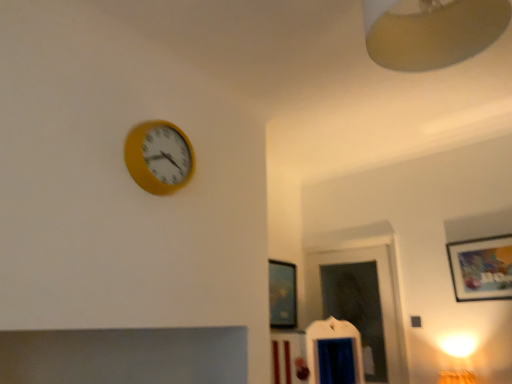
You are a GUI agent. You are given a task and a screenshot of the screen. Output one action in this format:
    pyautogui.click(x=<x>, y=<y>)
    Task: Click on the yellow matte clock at upper left
    The height and width of the screenshot is (384, 512).
    Given the screenshot: What is the action you would take?
    pyautogui.click(x=159, y=157)

What do you see at coordinates (481, 268) in the screenshot?
I see `matte wooden picture frame at upper right, the second picture frame when ordered from left to right` at bounding box center [481, 268].

This screenshot has width=512, height=384. Describe the element at coordinates (282, 294) in the screenshot. I see `matte black picture frame at center, which appears as the 2th picture frame when viewed from the front` at that location.

Locate an element on the screen. Image resolution: width=512 pixels, height=384 pixels. matte beige lampshade at upper right is located at coordinates (433, 33).

Image resolution: width=512 pixels, height=384 pixels. In order to click on yellow matte clock at upper left in this screenshot , I will do `click(159, 157)`.

Between yellow matte clock at upper left and matte wooden picture frame at upper right, which is counted as the 1th picture frame, starting from the front, which one has less height?

Standing shorter between the two is yellow matte clock at upper left.

You are a GUI agent. You are given a task and a screenshot of the screen. Output one action in this format:
    pyautogui.click(x=<x>, y=<y>)
    Task: Click on the wall clock that is above the matte wooden picture frame at upper right, the second picture frame when ordered from left to right (from the image's perspective)
    
    Given the screenshot: What is the action you would take?
    pyautogui.click(x=159, y=157)

Is matte wooden picture frame at upper right, the 2th picture frame in the back-to-front sequence, located within yellow matte clock at upper left?

That's incorrect, matte wooden picture frame at upper right, the 2th picture frame in the back-to-front sequence, is not inside yellow matte clock at upper left.

Who is shorter, matte black picture frame at center, marked as the 2th picture frame in a right-to-left arrangement, or matte beige lampshade at upper right?

With less height is matte beige lampshade at upper right.

From the image's perspective, is matte black picture frame at center, the 1th picture frame in the left-to-right sequence, located above matte beige lampshade at upper right?

Actually, matte black picture frame at center, the 1th picture frame in the left-to-right sequence, appears below matte beige lampshade at upper right in the image.

Based on the photo, in the image, is matte black picture frame at center, the 1th picture frame in the left-to-right sequence, on the left side or the right side of matte beige lampshade at upper right?

matte black picture frame at center, the 1th picture frame in the left-to-right sequence, is to the left of matte beige lampshade at upper right.

Considering the sizes of matte black picture frame at center, which is the first picture frame from back to front, and matte beige lampshade at upper right in the image, is matte black picture frame at center, which is the first picture frame from back to front, wider or thinner than matte beige lampshade at upper right?

matte black picture frame at center, which is the first picture frame from back to front, is thinner than matte beige lampshade at upper right.

In the scene shown: Is matte beige lampshade at upper right outside of matte black picture frame at center, the 1th picture frame in the left-to-right sequence?

matte beige lampshade at upper right is positioned outside matte black picture frame at center, the 1th picture frame in the left-to-right sequence.

Is matte beige lampshade at upper right in contact with matte black picture frame at center, which is the first picture frame from back to front?

No.

Is matte beige lampshade at upper right aimed at matte black picture frame at center, the 1th picture frame in the left-to-right sequence?

No, matte beige lampshade at upper right is not aimed at matte black picture frame at center, the 1th picture frame in the left-to-right sequence.

From the image's perspective, is matte beige lampshade at upper right on matte black picture frame at center, which appears as the 2th picture frame when viewed from the front?

Correct, matte beige lampshade at upper right appears higher than matte black picture frame at center, which appears as the 2th picture frame when viewed from the front, in the image.

Are matte black picture frame at center, the 1th picture frame in the left-to-right sequence, and matte wooden picture frame at upper right, which is counted as the 1th picture frame, starting from the front, located far from each other?

Yes.

From the picture: Considering the relative positions of matte black picture frame at center, the 1th picture frame in the left-to-right sequence, and matte wooden picture frame at upper right, which ranks as the first picture frame in right-to-left order, in the image provided, is matte black picture frame at center, the 1th picture frame in the left-to-right sequence, in front of matte wooden picture frame at upper right, which ranks as the first picture frame in right-to-left order,?

No, matte black picture frame at center, the 1th picture frame in the left-to-right sequence, is further to the viewer.

From a real-world perspective, is matte black picture frame at center, the 1th picture frame in the left-to-right sequence, physically located above or below matte wooden picture frame at upper right, the second picture frame when ordered from left to right?

In terms of real-world spatial position, matte black picture frame at center, the 1th picture frame in the left-to-right sequence, is below matte wooden picture frame at upper right, the second picture frame when ordered from left to right.

From the image's perspective, between matte beige lampshade at upper right and matte wooden picture frame at upper right, the 2th picture frame in the back-to-front sequence, who is located below?

matte wooden picture frame at upper right, the 2th picture frame in the back-to-front sequence.

Is matte beige lampshade at upper right directly adjacent to matte wooden picture frame at upper right, which is counted as the 1th picture frame, starting from the front?

No.

Is matte beige lampshade at upper right oriented away from matte wooden picture frame at upper right, the 2th picture frame in the back-to-front sequence?

Yes, matte beige lampshade at upper right's orientation is away from matte wooden picture frame at upper right, the 2th picture frame in the back-to-front sequence.

Considering the sizes of objects matte beige lampshade at upper right and matte wooden picture frame at upper right, the second picture frame when ordered from left to right, in the image provided, who is smaller, matte beige lampshade at upper right or matte wooden picture frame at upper right, the second picture frame when ordered from left to right,?

matte wooden picture frame at upper right, the second picture frame when ordered from left to right, is smaller.

Considering the relative sizes of yellow matte clock at upper left and matte black picture frame at center, which appears as the 2th picture frame when viewed from the front, in the image provided, is yellow matte clock at upper left thinner than matte black picture frame at center, which appears as the 2th picture frame when viewed from the front,?

Incorrect, the width of yellow matte clock at upper left is not less than that of matte black picture frame at center, which appears as the 2th picture frame when viewed from the front.

Does yellow matte clock at upper left have a smaller size compared to matte black picture frame at center, the 1th picture frame in the left-to-right sequence?

No, yellow matte clock at upper left is not smaller than matte black picture frame at center, the 1th picture frame in the left-to-right sequence.

Considering the sizes of objects yellow matte clock at upper left and matte black picture frame at center, the 1th picture frame in the left-to-right sequence, in the image provided, who is taller, yellow matte clock at upper left or matte black picture frame at center, the 1th picture frame in the left-to-right sequence,?

Standing taller between the two is matte black picture frame at center, the 1th picture frame in the left-to-right sequence.

Considering the positions of point (133, 151) and point (284, 279), is point (133, 151) closer or farther from the camera than point (284, 279)?

Point (133, 151) is positioned closer to the camera compared to point (284, 279).

In terms of height, does yellow matte clock at upper left look taller or shorter compared to matte beige lampshade at upper right?

In the image, yellow matte clock at upper left appears to be shorter than matte beige lampshade at upper right.

Would you say yellow matte clock at upper left is inside or outside matte beige lampshade at upper right?

yellow matte clock at upper left is outside matte beige lampshade at upper right.

From a real-world perspective, which object stands above the other?

In real-world perspective, matte beige lampshade at upper right is above.

From the yellow matte clock at upper left, count 2nd picture frame to the right and point to it. Please provide its 2D coordinates.

[(481, 268)]

From the matte beige lampshade at upper right, count 2nd picture frames backward and point to it. Please provide its 2D coordinates.

[(282, 294)]

When comparing their distances from matte wooden picture frame at upper right, which ranks as the first picture frame in right-to-left order, does matte black picture frame at center, which is the first picture frame from back to front, or matte beige lampshade at upper right seem further?

matte beige lampshade at upper right.

Considering their positions, is yellow matte clock at upper left positioned closer to matte wooden picture frame at upper right, which is counted as the 1th picture frame, starting from the front, than matte beige lampshade at upper right?

Based on the image, matte beige lampshade at upper right appears to be nearer to matte wooden picture frame at upper right, which is counted as the 1th picture frame, starting from the front.

Estimate the real-world distances between objects in this image. Which object is further from matte beige lampshade at upper right, matte black picture frame at center, the 1th picture frame in the left-to-right sequence, or matte wooden picture frame at upper right, which is counted as the 1th picture frame, starting from the front?

The object further to matte beige lampshade at upper right is matte black picture frame at center, the 1th picture frame in the left-to-right sequence.

Which object lies nearer to the anchor point yellow matte clock at upper left, matte black picture frame at center, which appears as the 2th picture frame when viewed from the front, or matte beige lampshade at upper right?

matte beige lampshade at upper right lies closer to yellow matte clock at upper left than the other object.

Estimate the real-world distances between objects in this image. Which object is closer to matte wooden picture frame at upper right, which is counted as the 1th picture frame, starting from the front, matte beige lampshade at upper right or yellow matte clock at upper left?

The object closer to matte wooden picture frame at upper right, which is counted as the 1th picture frame, starting from the front, is matte beige lampshade at upper right.

From the image, which object appears to be farther from matte wooden picture frame at upper right, which ranks as the first picture frame in right-to-left order, yellow matte clock at upper left or matte black picture frame at center, marked as the 2th picture frame in a right-to-left arrangement?

Based on the image, yellow matte clock at upper left appears to be further to matte wooden picture frame at upper right, which ranks as the first picture frame in right-to-left order.

Estimate the real-world distances between objects in this image. Which object is further from matte beige lampshade at upper right, yellow matte clock at upper left or matte black picture frame at center, which is the first picture frame from back to front?

matte black picture frame at center, which is the first picture frame from back to front.

Estimate the real-world distances between objects in this image. Which object is closer to yellow matte clock at upper left, matte beige lampshade at upper right or matte black picture frame at center, which appears as the 2th picture frame when viewed from the front?

matte beige lampshade at upper right.

The image size is (512, 384). I want to click on picture frame between matte beige lampshade at upper right and matte black picture frame at center, which is the first picture frame from back to front, along the z-axis, so click(x=481, y=268).

Where is `picture frame located between yellow matte clock at upper left and matte wooden picture frame at upper right, which is counted as the 1th picture frame, starting from the front, in the left-right direction`? The width and height of the screenshot is (512, 384). picture frame located between yellow matte clock at upper left and matte wooden picture frame at upper right, which is counted as the 1th picture frame, starting from the front, in the left-right direction is located at coordinates (282, 294).

This screenshot has height=384, width=512. Identify the location of lamp between yellow matte clock at upper left and matte wooden picture frame at upper right, the second picture frame when ordered from left to right, in the horizontal direction. (433, 33).

The width and height of the screenshot is (512, 384). What are the coordinates of `wall clock located between matte beige lampshade at upper right and matte black picture frame at center, which is the first picture frame from back to front, in the depth direction` in the screenshot? It's located at (159, 157).